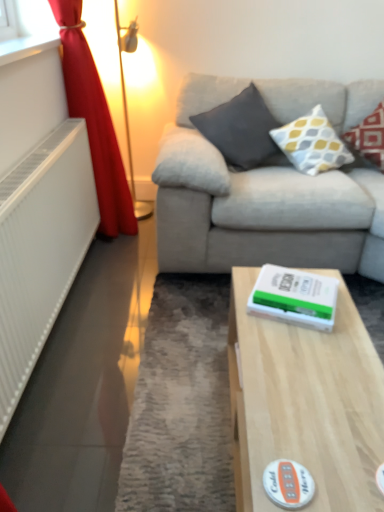
You are a GUI agent. You are given a task and a screenshot of the screen. Output one action in this format:
    pyautogui.click(x=<x>, y=<y>)
    Task: Click on the free space to the back side of white matte sticker at lower center
    Image resolution: width=384 pixels, height=512 pixels.
    Given the screenshot: What is the action you would take?
    pyautogui.click(x=289, y=418)